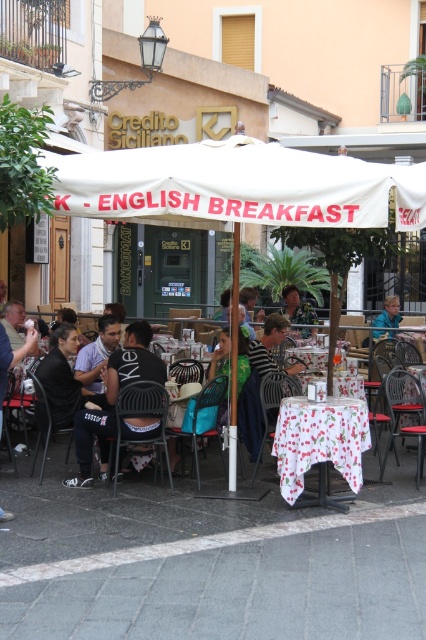
Is white floral tablecloth at center further to the viewer compared to camouflage fabric shirt at center?

No, it is not.

Who is shorter, white floral tablecloth at center or camouflage fabric shirt at center?

Standing shorter between the two is camouflage fabric shirt at center.

Which is in front, point (317, 413) or point (302, 314)?

Positioned in front is point (317, 413).

At what (x,y) coordinates should I click in order to perform the action: click on white floral tablecloth at center. Please return your answer as a coordinate pair (x, y). This screenshot has width=426, height=640. Looking at the image, I should click on (319, 440).

Based on the photo, who is shorter, dark blue shirt at center or camouflage fabric shirt at center?

camouflage fabric shirt at center is shorter.

Is dark blue shirt at center further to the viewer compared to camouflage fabric shirt at center?

That is False.

Does point (103, 317) come farther from viewer compared to point (305, 316)?

No.

I want to click on dark blue shirt at center, so click(x=97, y=353).

In the scene shown: Does white fabric canopy at center appear over white floral tablecloth at center?

Yes.

What do you see at coordinates (236, 186) in the screenshot? I see `white fabric canopy at center` at bounding box center [236, 186].

Between point (227, 200) and point (327, 400), which one is positioned behind?

The point (327, 400) is more distant.

Find the location of a particular element. The width and height of the screenshot is (426, 640). white fabric canopy at center is located at coordinates (236, 186).